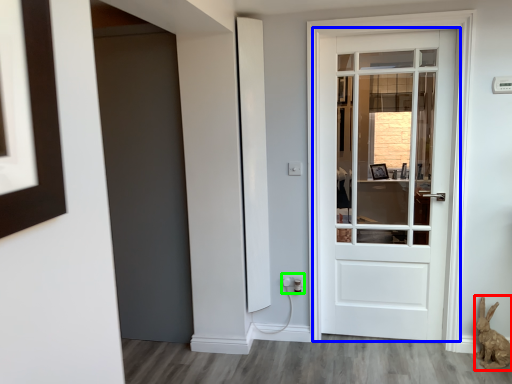
Question: Based on their relative distances, which object is nearer to animal (highlighted by a red box)? Choose from door (highlighted by a blue box) and electric outlet (highlighted by a green box).

Choices:
 (A) door
 (B) electric outlet

Answer: (B)